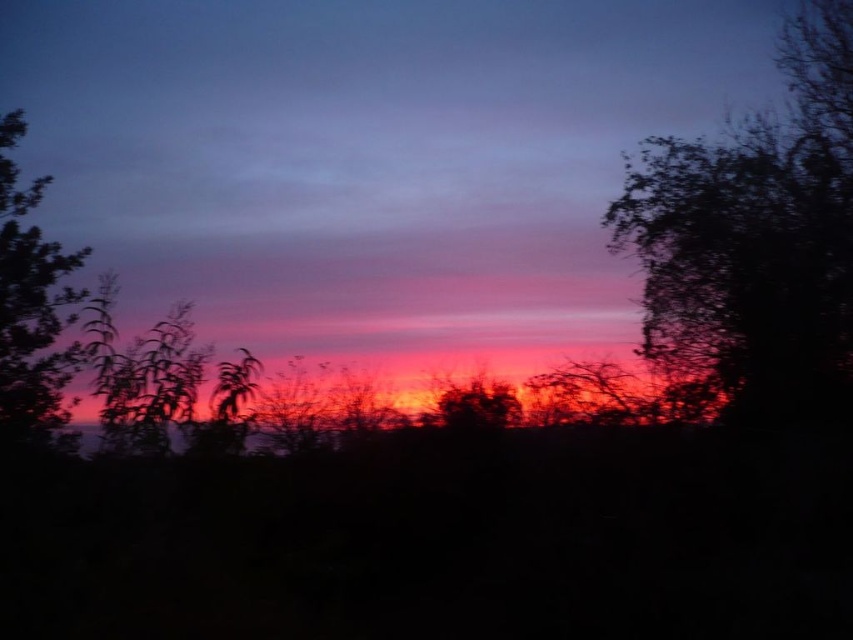
Does silhouette leafy tree at right have a lesser height compared to silky purple leaves at left?

Indeed, silhouette leafy tree at right has a lesser height compared to silky purple leaves at left.

Is silhouette leafy tree at right positioned at the back of silky purple leaves at left?

Yes, silhouette leafy tree at right is further from the viewer.

Between point (795, 204) and point (33, 376), which one is positioned in front?

Positioned in front is point (33, 376).

This screenshot has height=640, width=853. In order to click on silhouette leafy tree at right in this screenshot , I will do `click(755, 237)`.